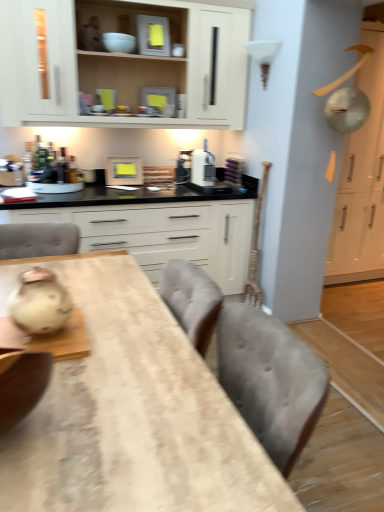
The image size is (384, 512). I want to click on vacant space situated above wooden table at center (from a real-world perspective), so click(111, 347).